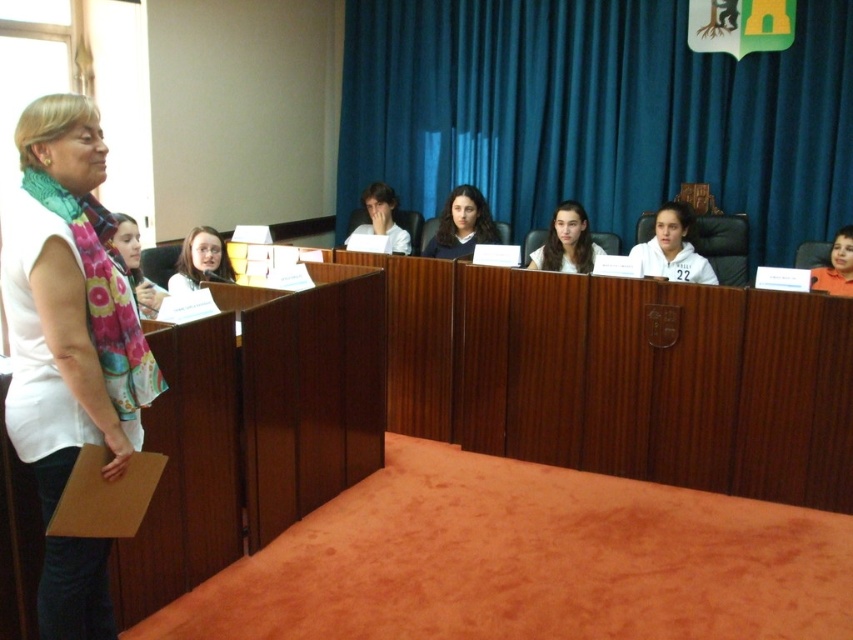
You are a photographer in the audience and want to take a clear photo of the smooth brown hair at center without the white matte shirt at center blocking it. What should you do?

Move to a position where the white matte shirt at center is no longer in front of the smooth brown hair at center. Since the white matte shirt at center is currently in front of smooth brown hair at center, moving to the side or behind the speaker could allow you to capture the smooth brown hair at center without obstruction.

You are standing in the room and see two points marked in the image. Which point is closer to you, point (440, 192) or point (364, 196)?

Point (440, 192) is further to the viewer than point (364, 196), so point (364, 196) is closer to you.

You are standing at the entrance of the room and want to locate the person with smooth brown hair at center. According to the coordinates provided, where should you look to find them?

The person with smooth brown hair at center is located at coordinates point (566,241), so you should look towards the lower middle section of the room.